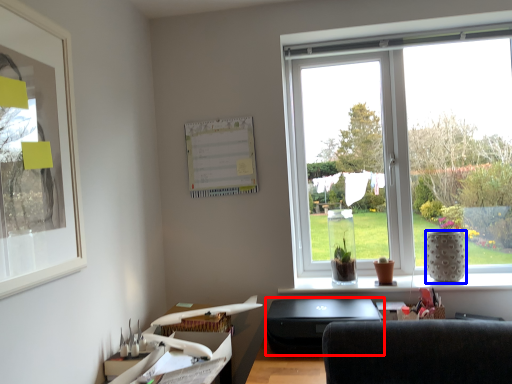
Question: Which of the following is the closest to the observer, desktop (highlighted by a red box) or vase (highlighted by a blue box)?

Choices:
 (A) desktop
 (B) vase

Answer: (A)